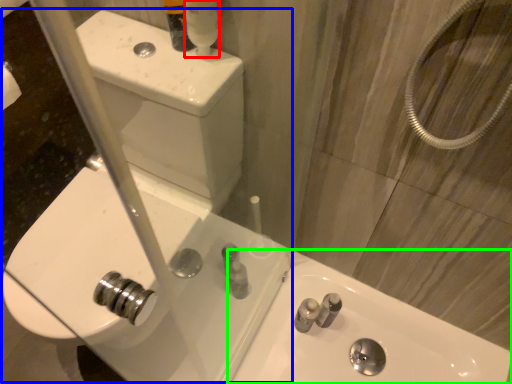
Question: Based on their relative distances, which object is nearer to mouthwash (highlighted by a red box)? Choose from sink (highlighted by a blue box) and sink (highlighted by a green box).

Choices:
 (A) sink
 (B) sink

Answer: (A)